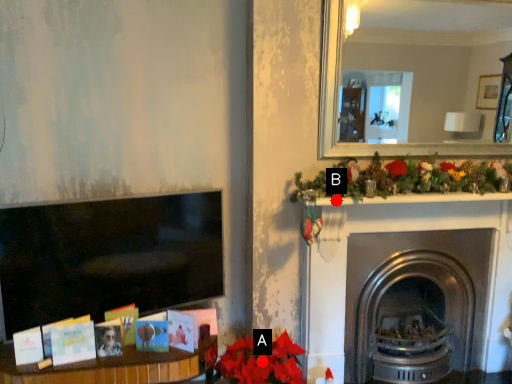
Question: Two points are circled on the image, labeled by A and B beside each circle. Which point is farther from the camera taking this photo?

Choices:
 (A) A is further
 (B) B is further

Answer: (A)